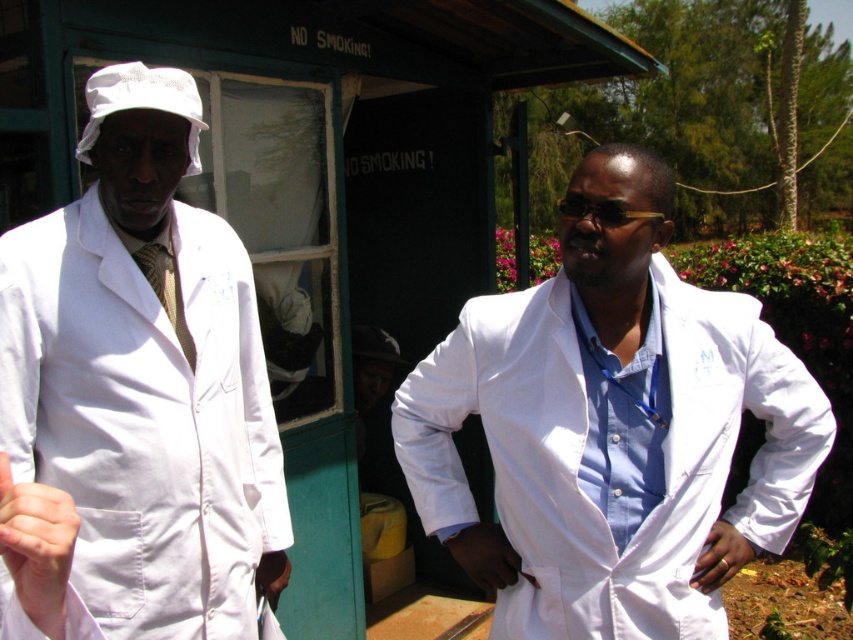
Can you confirm if white matte lab coat at right is positioned to the left of white matte lab coat at left?

In fact, white matte lab coat at right is to the right of white matte lab coat at left.

The image size is (853, 640). Describe the element at coordinates (611, 428) in the screenshot. I see `white matte lab coat at right` at that location.

Locate an element on the screen. This screenshot has width=853, height=640. white matte lab coat at right is located at coordinates (611, 428).